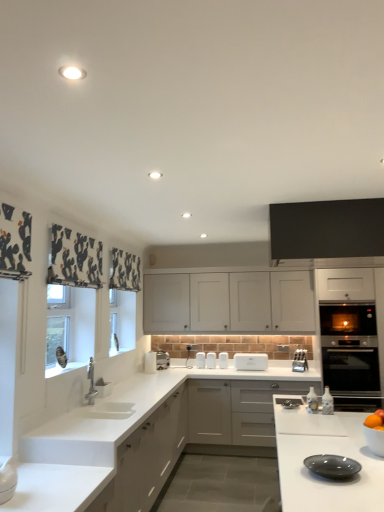
Question: From a real-world perspective, relative to black stainless steel oven at right, which is counted as the second oven, starting from the top, is matte gray plate at lower right vertically above or below?

Choices:
 (A) below
 (B) above

Answer: (B)

Question: Is matte gray plate at lower right inside the boundaries of black stainless steel oven at right, which is counted as the second oven, starting from the top, or outside?

Choices:
 (A) outside
 (B) inside

Answer: (A)

Question: Which is nearer to the white matte cabinet at center, which is the second cabinetry from bottom to top?

Choices:
 (A) metallic silver knife block at lower right, the 2th appliance viewed from the left
 (B) white matte countertop at lower left, marked as the second countertop in a front-to-back arrangement
 (C) white matte cabinet at center, marked as the third cabinetry in a top-to-bottom arrangement
 (D) orange matte at right
 (E) white glossy countertop at lower right, the 1th countertop viewed from the front

Answer: (A)

Question: Which of these objects is positioned farthest from the white matte cabinet at center, the 1th cabinetry when ordered from bottom to top?

Choices:
 (A) black stainless steel oven at right, which is the first oven from bottom to top
 (B) black matte cabinet at upper center, which is the third cabinetry from back to front
 (C) white matte cabinet at center, which is the second cabinetry from bottom to top
 (D) white glossy countertop at lower right, placed as the 2th countertop when sorted from back to front
 (E) matte gray plate at lower right

Answer: (E)